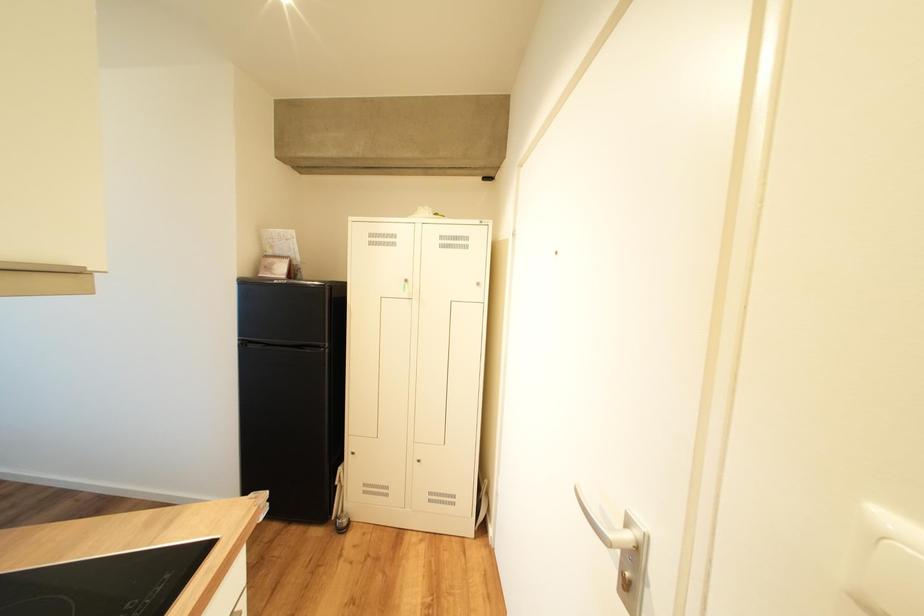
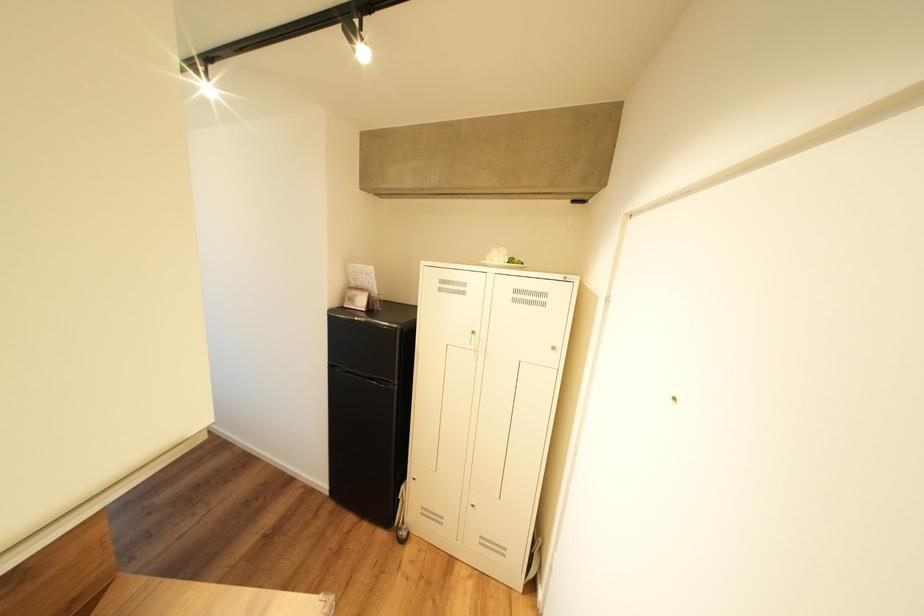
Question: In a continuous first-person perspective shot, in which direction is the camera moving?

Choices:
 (A) Left
 (B) Right
 (C) Forward
 (D) Backward

Answer: (C)